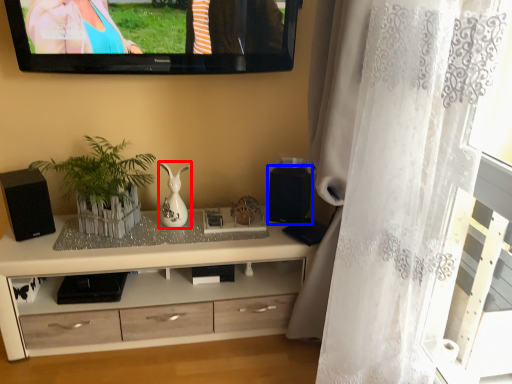
Question: Which of the following is the closest to the observer, vase (highlighted by a red box) or speaker (highlighted by a blue box)?

Choices:
 (A) vase
 (B) speaker

Answer: (A)